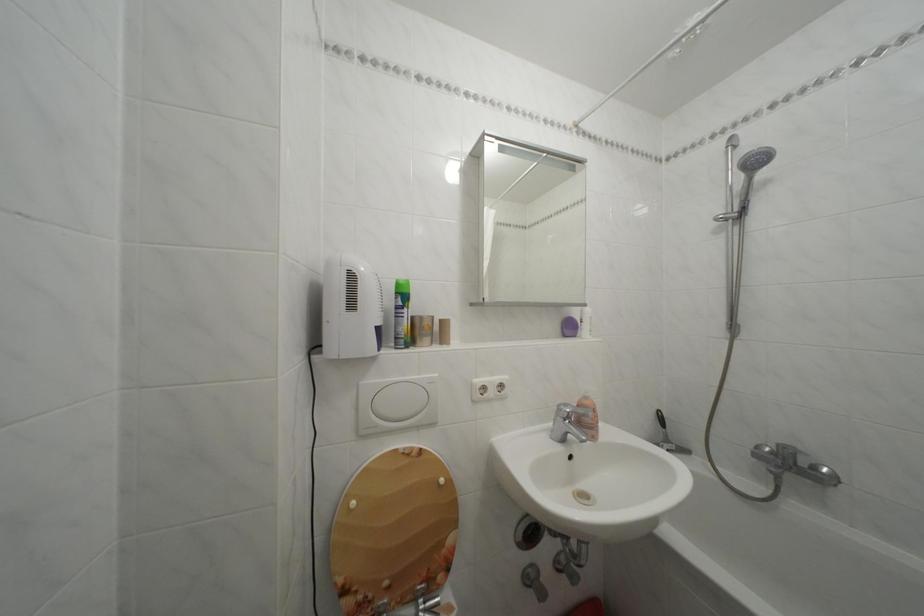
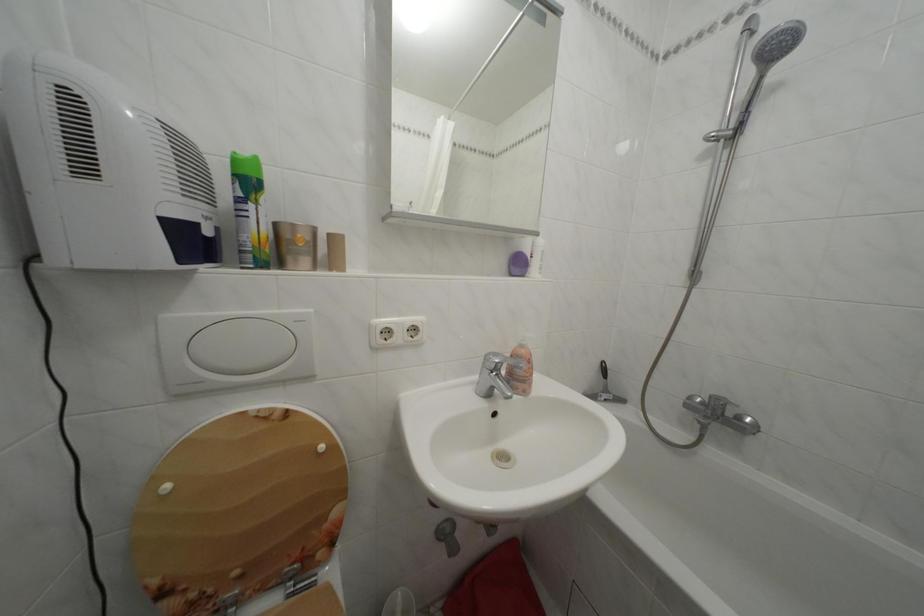
In a continuous first-person perspective shot, in which direction is the camera moving?

The cameraman walked toward right, forward.